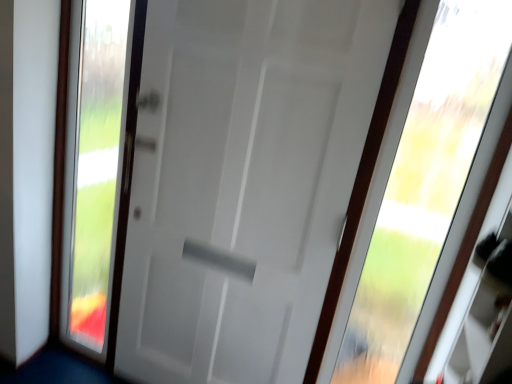
Locate an element on the screen. transparent glass window at upper right is located at coordinates (424, 183).

What do you see at coordinates (97, 166) in the screenshot? I see `transparent glass door at left` at bounding box center [97, 166].

Image resolution: width=512 pixels, height=384 pixels. I want to click on transparent glass window at upper right, so click(424, 183).

Considering the relative sizes of transparent glass door at left and white matte door at center in the image provided, is transparent glass door at left shorter than white matte door at center?

Yes.

Is white matte door at center at the back of transparent glass door at left?

No, transparent glass door at left is not facing the opposite direction of white matte door at center.

Does transparent glass door at left touch white matte door at center?

No, transparent glass door at left is not next to white matte door at center.

From a real-world perspective, which is physically above, white matte door at center or transparent glass door at left?

From a 3D spatial view, white matte door at center is above.

Is white matte door at center positioned behind transparent glass door at left?

No, it is in front of transparent glass door at left.

How many degrees apart are the facing directions of white matte door at center and transparent glass door at left?

The angular difference between white matte door at center and transparent glass door at left is 0.165 degrees.

Between white matte door at center and transparent glass door at left, which one has smaller width?

transparent glass door at left.

Is transparent glass window at upper right taller or shorter than transparent glass door at left?

transparent glass window at upper right is shorter than transparent glass door at left.

Could you tell me if transparent glass window at upper right is turned towards transparent glass door at left?

No, transparent glass window at upper right is not aimed at transparent glass door at left.

From the image's perspective, which is above, transparent glass window at upper right or transparent glass door at left?

From the image's view, transparent glass door at left is above.

Is transparent glass window at upper right positioned far away from transparent glass door at left?

That's right, there is a large distance between transparent glass window at upper right and transparent glass door at left.

Are transparent glass window at upper right and white matte door at center beside each other?

No, transparent glass window at upper right is not in contact with white matte door at center.

Does point (484, 40) lie behind point (168, 92)?

No, (484, 40) is closer to viewer.

Choose the correct answer: Is transparent glass window at upper right inside white matte door at center or outside it?

transparent glass window at upper right is spatially situated outside white matte door at center.

Is transparent glass window at upper right oriented towards white matte door at center?

No, transparent glass window at upper right is not turned towards white matte door at center.

Which object is wider, transparent glass door at left or transparent glass window at upper right?

transparent glass window at upper right.

Looking at this image, considering the relative positions of transparent glass door at left and transparent glass window at upper right in the image provided, is transparent glass door at left to the left of transparent glass window at upper right from the viewer's perspective?

Correct, you'll find transparent glass door at left to the left of transparent glass window at upper right.

From a real-world perspective, is transparent glass door at left positioned above or below transparent glass window at upper right?

transparent glass door at left is situated lower than transparent glass window at upper right in the real world.

What are the coordinates of `window on the right of transparent glass door at left` in the screenshot? It's located at (424, 183).

Considering the sizes of white matte door at center and transparent glass window at upper right in the image, is white matte door at center wider or thinner than transparent glass window at upper right?

Clearly, white matte door at center has more width compared to transparent glass window at upper right.

Does point (333, 84) come closer to viewer compared to point (383, 326)?

Yes, it is.

In terms of size, does white matte door at center appear bigger or smaller than transparent glass window at upper right?

Considering their sizes, white matte door at center takes up more space than transparent glass window at upper right.

From the image's perspective, is white matte door at center located above or below transparent glass window at upper right?

white matte door at center is situated lower than transparent glass window at upper right in the image.

At what (x,y) coordinates should I click in order to perform the action: click on door that appears on the right of transparent glass door at left. Please return your answer as a coordinate pair (x, y). Image resolution: width=512 pixels, height=384 pixels. Looking at the image, I should click on (243, 181).

Where is `glass window directly beneath the white matte door at center (from a real-world perspective)`? The width and height of the screenshot is (512, 384). glass window directly beneath the white matte door at center (from a real-world perspective) is located at coordinates (97, 166).

Looking at the image, which one is located further to transparent glass window at upper right, transparent glass door at left or white matte door at center?

Based on the image, transparent glass door at left appears to be further to transparent glass window at upper right.

Looking at this image, based on their spatial positions, is white matte door at center or transparent glass door at left further from transparent glass window at upper right?

The object further to transparent glass window at upper right is transparent glass door at left.

Which object lies nearer to the anchor point white matte door at center, transparent glass door at left or transparent glass window at upper right?

transparent glass door at left lies closer to white matte door at center than the other object.

Estimate the real-world distances between objects in this image. Which object is closer to transparent glass door at left, transparent glass window at upper right or white matte door at center?

white matte door at center lies closer to transparent glass door at left than the other object.

From the image, which object appears to be nearer to white matte door at center, transparent glass window at upper right or transparent glass door at left?

transparent glass door at left.

Which object lies further to the anchor point transparent glass door at left, white matte door at center or transparent glass window at upper right?

transparent glass window at upper right lies further to transparent glass door at left than the other object.

Locate an element on the screen. The width and height of the screenshot is (512, 384). door between transparent glass door at left and transparent glass window at upper right in the horizontal direction is located at coordinates (243, 181).